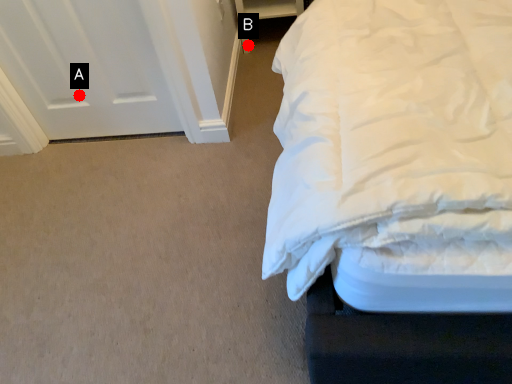
Question: Two points are circled on the image, labeled by A and B beside each circle. Which point appears closest to the camera in this image?

Choices:
 (A) A is closer
 (B) B is closer

Answer: (A)